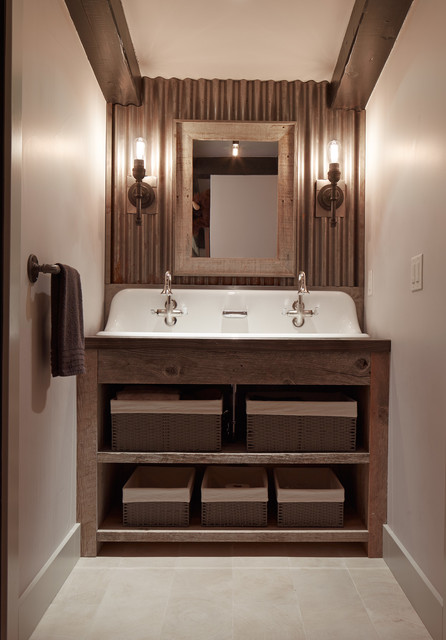
You are a GUI agent. You are given a task and a screenshot of the screen. Output one action in this format:
    pyautogui.click(x=<x>, y=<y>)
    Task: Click on the baseboard
    
    Given the screenshot: What is the action you would take?
    pyautogui.click(x=52, y=577), pyautogui.click(x=405, y=577)